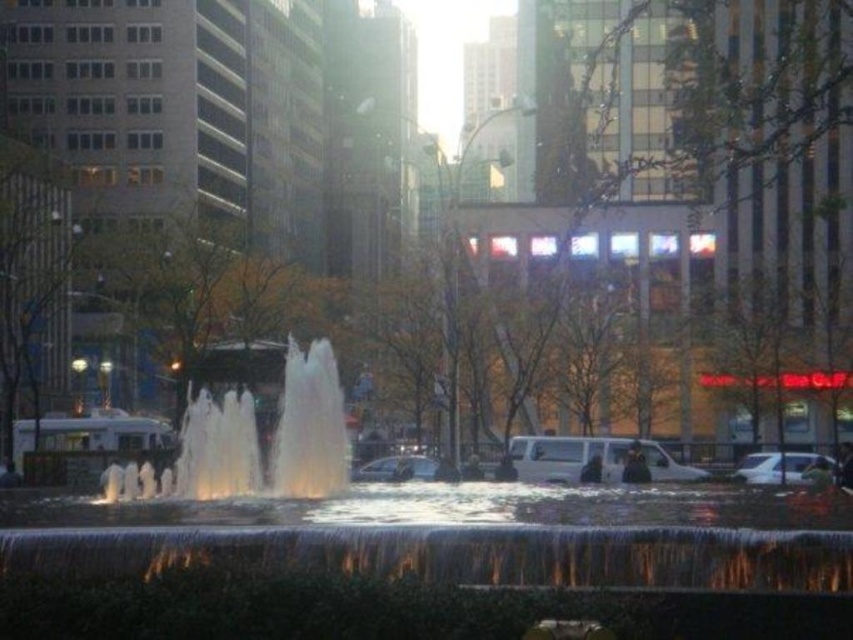
You are a photographer positioned at the edge of the plaza. You want to capture the white matte van at center and the clear water at center in the same frame. Based on their positions, which object should you adjust your camera to focus on first if you want to include both in your shot?

The clear water at center is to the left of the white matte van at center, so you should focus on the white matte van at center first to ensure both objects are in the frame.

You are a photographer wanting to capture the fountain and the van in the same frame. Given that the clear water at center reaches a certain height, will the white matte van at center be fully visible in the photo?

The clear water at center is taller than the white matte van at center, so the van will not be fully visible in the photo as the water exceeds its height.